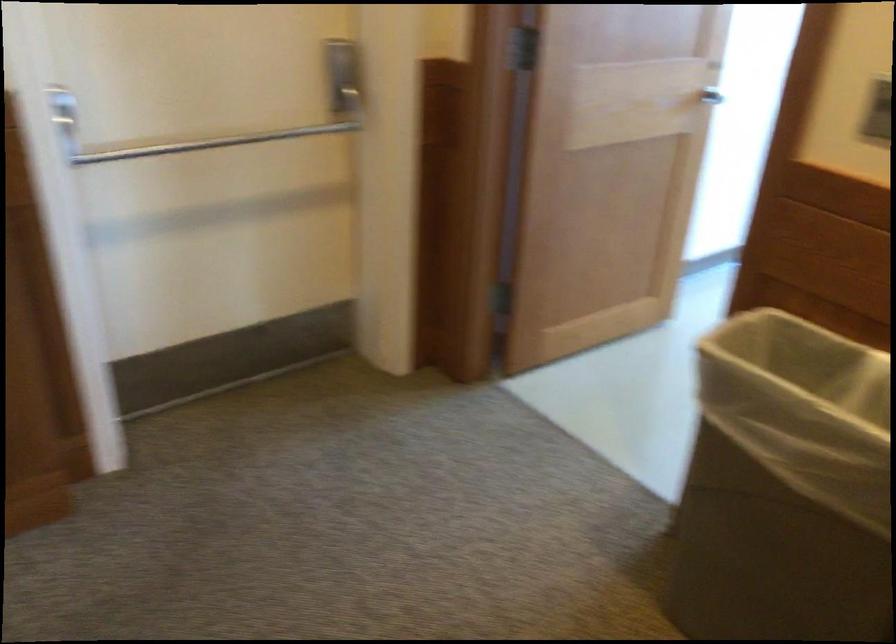
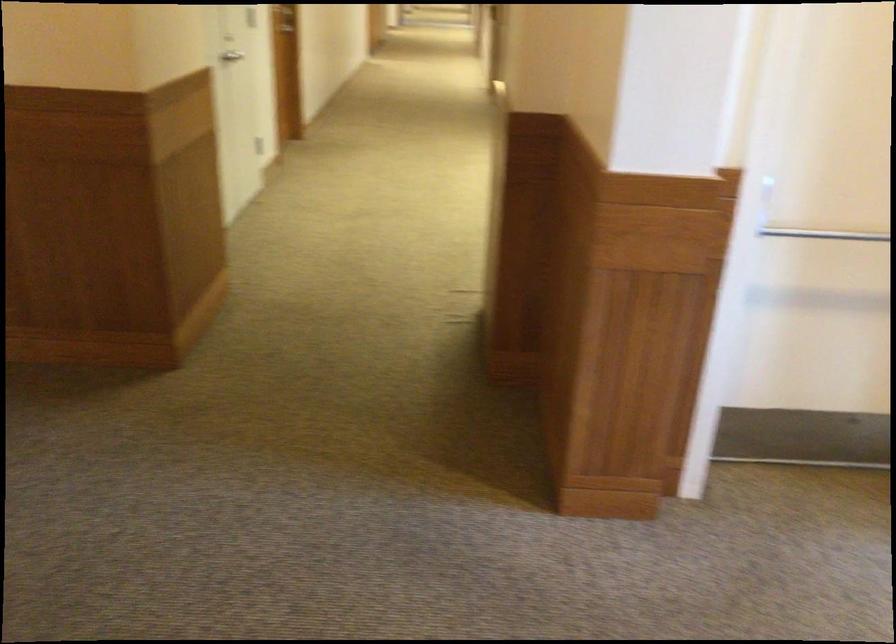
Question: How did the camera likely rotate?

Choices:
 (A) Left
 (B) Right
 (C) Up
 (D) Down

Answer: (A)